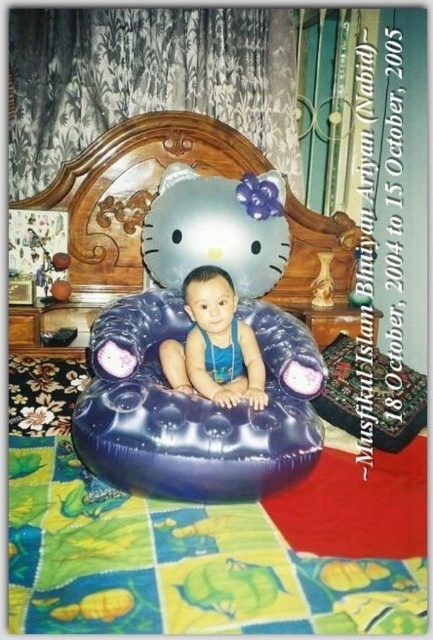
You are a photographer taking a picture of the child in the Hello Kitty chair. You need to focus on the point closest to the camera between the two points, point 1 at coordinates (115, 385) and point 2 at coordinates (258, 403). Which point should you focus on?

You should focus on point 1 at coordinates (115, 385) because it is closer to the camera than point 2 at coordinates (258, 403).

You are a photographer standing at the camera position. You want to take a photo of the blue rubber bean bag chair at center. The camera has a focal length of 50mm. What is the minimum distance you need to move forward or backward to ensure the subject fills the frame properly?

The blue rubber bean bag chair at center and camera are 3.47 feet apart from each other. To ensure the subject fills the frame properly with a 50mm lens, you should adjust your distance to approximately 3.47 feet, as the current distance already aligns with the focal length requirements for proper framing.

You are a parent trying to place a new toy box in your child room. The toy box is 0.5 meters wide. The blue rubber bean bag chair at center is currently occupying the space at point (x=194, y=406). Can you place the toy box there without moving the blue rubber bean bag chair at center?

The point (x=194, y=406) is marked as the location of the blue rubber bean bag chair at center, so placing the toy box there would require moving the blue rubber bean bag chair at center. Therefore, you cannot place the toy box there without moving it.